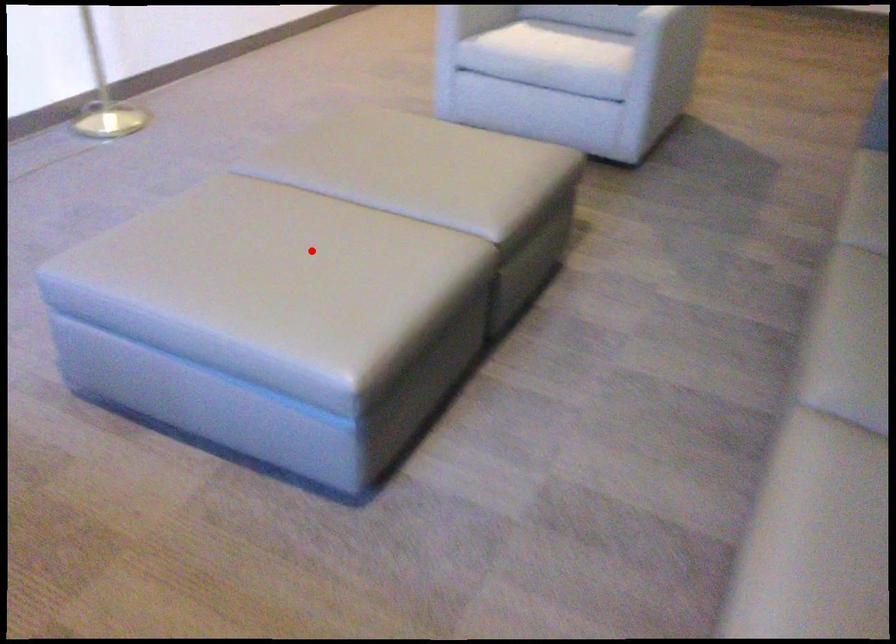
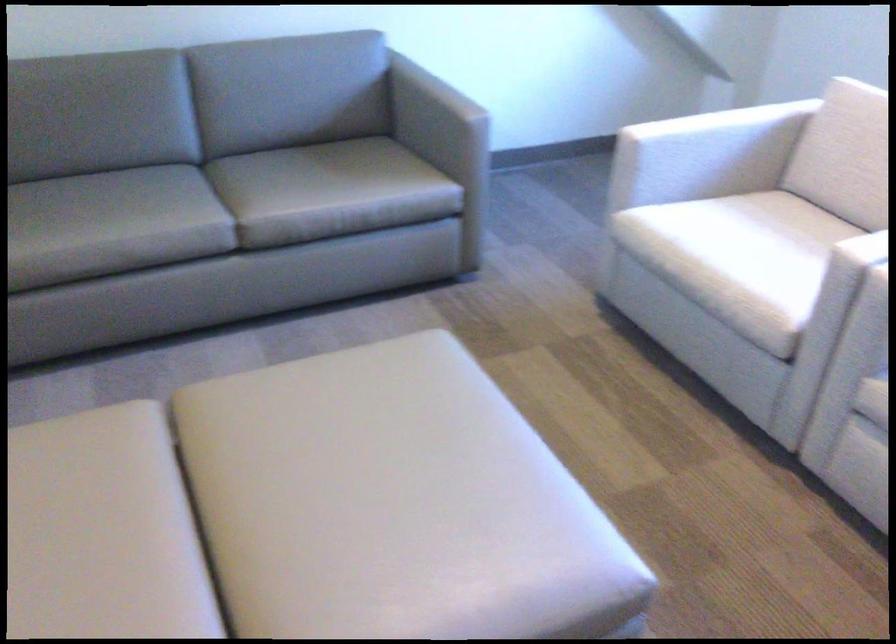
Question: I am providing you with two images of the same scene from different viewpoints. A red point is shown in image1. For the corresponding object point in image2, is it positioned nearer or farther from the camera?

Choices:
 (A) Nearer
 (B) Farther

Answer: (A)